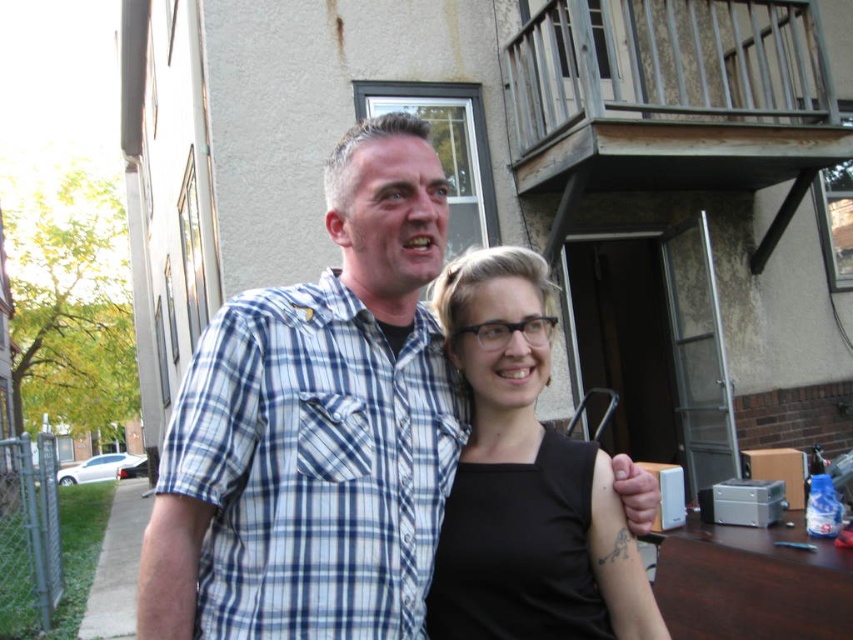
What is the color of the shirt worn by the person at the point marked by the coordinates (x=316, y=428)?

The point at coordinates (x=316, y=428) marks the blue plaid shirt at center, so the color of the shirt is blue.

You are a photographer trying to focus your camera on the blue plaid shirt at center. What are the coordinates where you should aim your camera?

You should aim your camera at coordinates point (316, 428) to focus on the blue plaid shirt at center.

You are a photographer trying to capture a group photo of the blue plaid shirt at center and the black matte tank top at center. Since you want to ensure both subjects are in focus, you need to know their heights. Which subject is taller?

The blue plaid shirt at center is much taller than the black matte tank top at center, so the photographer should adjust the camera angle to account for the height difference to ensure both are in focus.